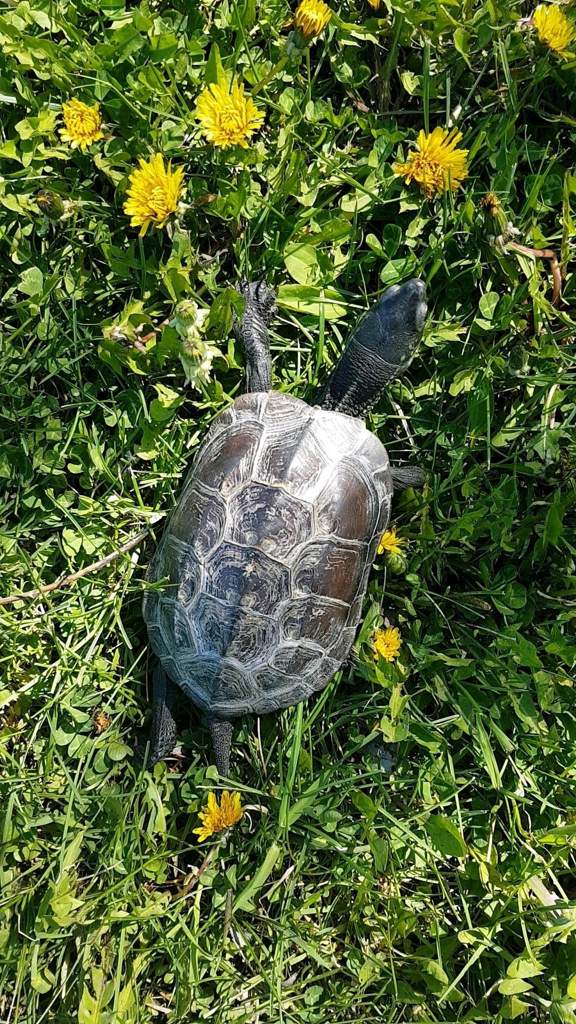
The height and width of the screenshot is (1024, 576). Find the location of `plant`. plant is located at coordinates (192, 342).